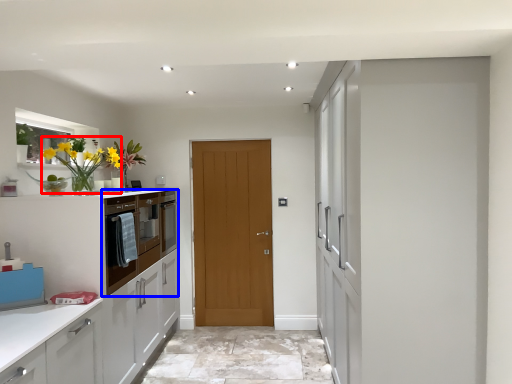
Question: Which of the following is the closest to the observer, floral arrangement (highlighted by a red box) or cabinetry (highlighted by a blue box)?

Choices:
 (A) floral arrangement
 (B) cabinetry

Answer: (A)